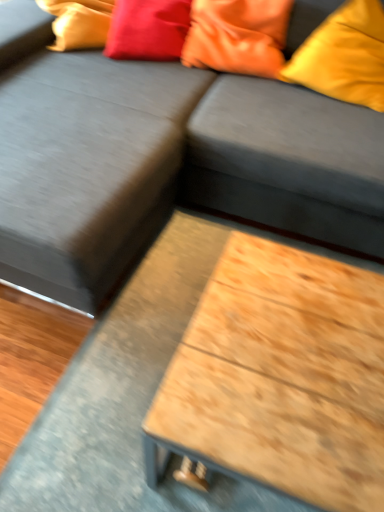
Question: Does wooden table at center have a lesser width compared to matte orange pillow at upper right, the first pillow positioned from the right?

Choices:
 (A) yes
 (B) no

Answer: (B)

Question: Is wooden table at center behind matte orange pillow at upper right, the first pillow positioned from the right?

Choices:
 (A) no
 (B) yes

Answer: (A)

Question: Is wooden table at center aimed at matte orange pillow at upper right, placed as the third pillow when sorted from left to right?

Choices:
 (A) no
 (B) yes

Answer: (A)

Question: Is wooden table at center touching matte orange pillow at upper right, placed as the third pillow when sorted from left to right?

Choices:
 (A) yes
 (B) no

Answer: (B)

Question: Is wooden table at center taller than matte orange pillow at upper right, placed as the third pillow when sorted from left to right?

Choices:
 (A) no
 (B) yes

Answer: (A)

Question: From the image's perspective, is satin red pillow at upper center, the 3th pillow when ordered from right to left, located above or below wooden at lower right?

Choices:
 (A) above
 (B) below

Answer: (A)

Question: Considering the relative positions of satin red pillow at upper center, the 3th pillow when ordered from right to left, and wooden at lower right in the image provided, is satin red pillow at upper center, the 3th pillow when ordered from right to left, to the left or to the right of wooden at lower right?

Choices:
 (A) right
 (B) left

Answer: (B)

Question: Is satin red pillow at upper center, arranged as the 1th pillow when viewed from the left, spatially inside wooden at lower right, or outside of it?

Choices:
 (A) outside
 (B) inside

Answer: (A)

Question: Does point (115, 3) appear closer or farther from the camera than point (243, 89)?

Choices:
 (A) closer
 (B) farther

Answer: (B)

Question: Considering their positions, is wooden at lower right located in front of or behind wooden table at center?

Choices:
 (A) behind
 (B) front

Answer: (A)

Question: Considering the positions of wooden at lower right and wooden table at center in the image, is wooden at lower right bigger or smaller than wooden table at center?

Choices:
 (A) big
 (B) small

Answer: (A)

Question: Choose the correct answer: Is wooden at lower right inside wooden table at center or outside it?

Choices:
 (A) outside
 (B) inside

Answer: (A)

Question: Does point (261, 165) appear closer or farther from the camera than point (46, 456)?

Choices:
 (A) closer
 (B) farther

Answer: (B)

Question: In terms of height, does satin red pillow at upper center, the 3th pillow when ordered from right to left, look taller or shorter compared to dark gray fabric couch at center?

Choices:
 (A) tall
 (B) short

Answer: (B)

Question: Does point (180, 6) appear closer or farther from the camera than point (230, 102)?

Choices:
 (A) farther
 (B) closer

Answer: (A)